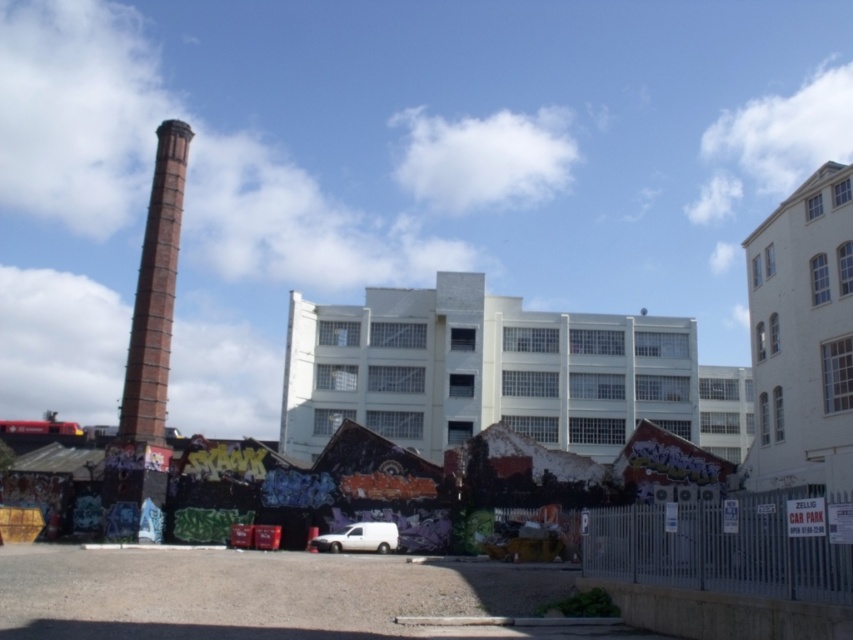
Is white matte building at center closer to camera compared to red brick chimney at left?

No.

Is point (386, 346) more distant than point (157, 161)?

Yes, it is.

This screenshot has width=853, height=640. What are the coordinates of `white matte building at center` in the screenshot? It's located at (480, 371).

Find the location of a particular element. The width and height of the screenshot is (853, 640). white matte building at center is located at coordinates click(x=480, y=371).

Is the position of white matte building at center less distant than that of white matte van at lower center?

No, it is not.

In the scene shown: Can you confirm if white matte building at center is smaller than white matte van at lower center?

No, white matte building at center is not smaller than white matte van at lower center.

Who is more forward, (x=637, y=397) or (x=370, y=522)?

Point (x=370, y=522)

The image size is (853, 640). Identify the location of white matte building at center. (480, 371).

Which is below, red brick chimney at left or white matte van at lower center?

white matte van at lower center is below.

Consider the image. Can you confirm if red brick chimney at left is bigger than white matte van at lower center?

Yes, red brick chimney at left is bigger than white matte van at lower center.

Does point (172, 189) come closer to viewer compared to point (393, 522)?

No, it is not.

You are a GUI agent. You are given a task and a screenshot of the screen. Output one action in this format:
    pyautogui.click(x=<x>, y=<y>)
    Task: Click on the red brick chimney at left
    Image resolution: width=853 pixels, height=640 pixels.
    Given the screenshot: What is the action you would take?
    pyautogui.click(x=155, y=292)